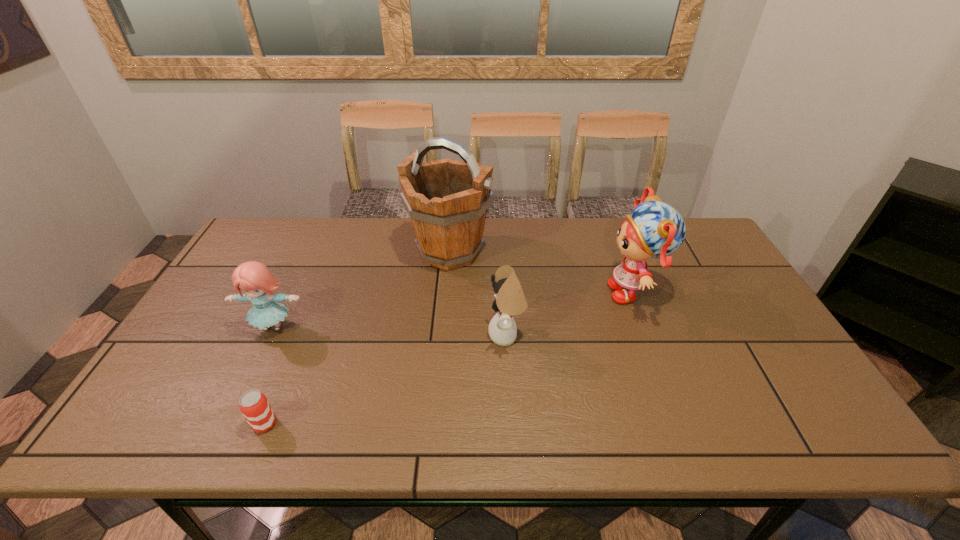
Identify the location of vacant space located on the face of the fourth shortest object. (564, 292).

At what (x,y) coordinates should I click in order to perform the action: click on vacant region located at the front face of the second doll from left to right. Please return your answer as a coordinate pair (x, y). Looking at the image, I should click on (378, 335).

Find the location of `free space located 0.170m at the front face of the second doll from left to right`. free space located 0.170m at the front face of the second doll from left to right is located at coordinates (423, 335).

The width and height of the screenshot is (960, 540). Identify the location of free space located 0.320m at the front face of the second doll from left to right. (367, 335).

You are a GUI agent. You are given a task and a screenshot of the screen. Output one action in this format:
    pyautogui.click(x=<x>, y=<y>)
    Task: Click on the free region located 0.070m on the front-facing side of the leftmost doll
    The width and height of the screenshot is (960, 540).
    Given the screenshot: What is the action you would take?
    (256, 363)

Locate an element on the screen. The image size is (960, 540). vacant area situated on the back of the nearest object is located at coordinates (297, 345).

I want to click on object present at the far edge, so [447, 200].

What are the coordinates of `object at the near edge` in the screenshot? It's located at (253, 404).

Where is `object that is at the left edge`? The image size is (960, 540). object that is at the left edge is located at coordinates (256, 281).

The image size is (960, 540). Identify the location of vacant area at the far edge. (307, 252).